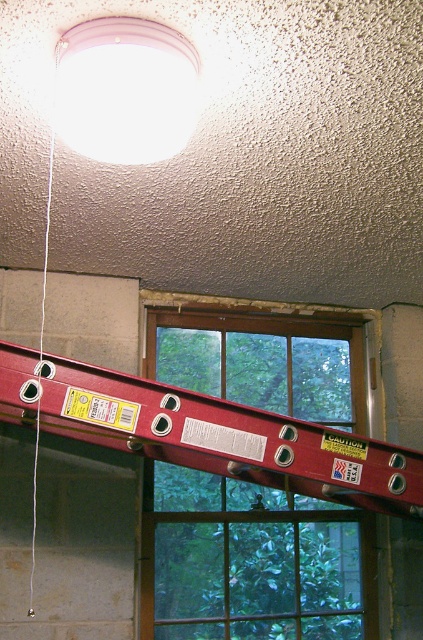
Question: Is white matte light fixture at upper center wider than white string at left?

Choices:
 (A) yes
 (B) no

Answer: (B)

Question: Can you confirm if clear glass window at center is thinner than white string at left?

Choices:
 (A) yes
 (B) no

Answer: (B)

Question: Among these points, which one is nearest to the camera?

Choices:
 (A) (49, 136)
 (B) (195, 435)
 (C) (142, 97)
 (D) (198, 493)

Answer: (C)

Question: Can you confirm if clear glass window at center is bigger than white matte light fixture at upper center?

Choices:
 (A) no
 (B) yes

Answer: (B)

Question: Which point is closer to the camera?

Choices:
 (A) white matte light fixture at upper center
 (B) white string at left

Answer: (A)

Question: Which point is farther from the camera taking this photo?

Choices:
 (A) click(32, 486)
 (B) click(323, 611)

Answer: (B)